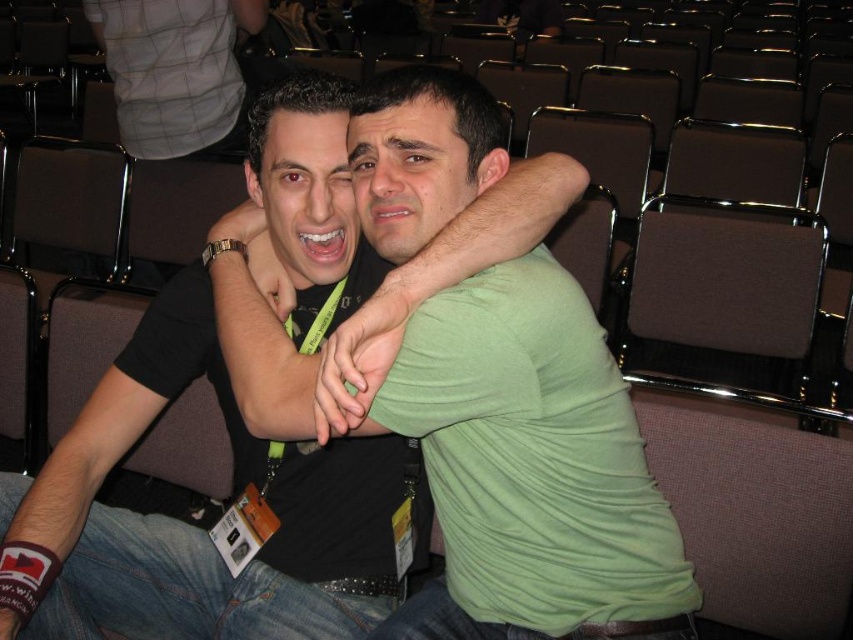
Can you confirm if green matte shirt at center is thinner than green matte arm at center?

No.

Who is lower down, green matte shirt at center or green matte arm at center?

green matte shirt at center

Is point (283, 259) positioned before point (437, 259)?

No, it is not.

The height and width of the screenshot is (640, 853). In order to click on green matte shirt at center in this screenshot , I will do `click(190, 525)`.

Does maroon fabric wristband at lower left have a greater width compared to green matte arm at center?

No, maroon fabric wristband at lower left is not wider than green matte arm at center.

Is point (186, 337) more distant than point (328, 384)?

Yes, it is behind point (328, 384).

Where is `maroon fabric wristband at lower left`? maroon fabric wristband at lower left is located at coordinates (103, 436).

Who is shorter, green matte shirt at center or maroon fabric wristband at lower left?

maroon fabric wristband at lower left

Which is in front, point (548, 157) or point (114, 451)?

Point (548, 157) is in front.

The image size is (853, 640). I want to click on green matte shirt at center, so click(190, 525).